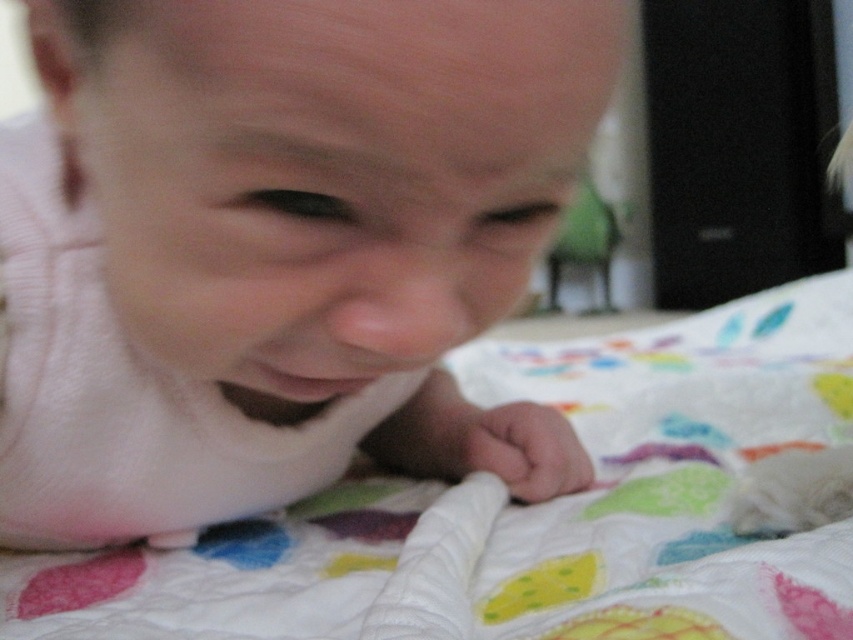
Can you confirm if pink soft fabric baby at center is smaller than white quilt at center?

Yes, pink soft fabric baby at center is smaller than white quilt at center.

Which is above, pink soft fabric baby at center or white quilt at center?

pink soft fabric baby at center is higher up.

Describe the element at coordinates (277, 250) in the screenshot. I see `pink soft fabric baby at center` at that location.

Where is `pink soft fabric baby at center`? pink soft fabric baby at center is located at coordinates (277, 250).